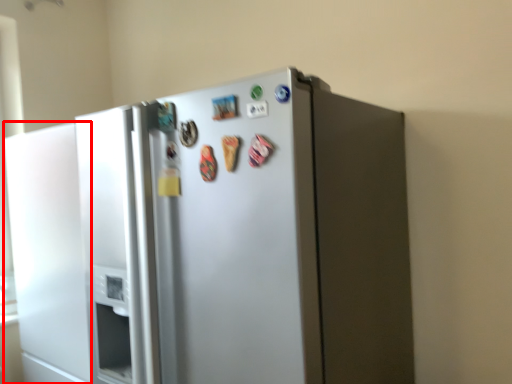
Question: From the image's perspective, where is door (annotated by the red box) located in relation to refrigerator in the image?

Choices:
 (A) above
 (B) below

Answer: (B)